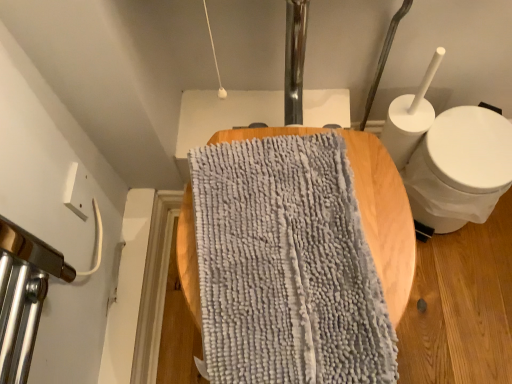
Question: Can you confirm if gray fuzzy bath towel at center is positioned to the left of white matte toilet at right?

Choices:
 (A) yes
 (B) no

Answer: (A)

Question: From the image's perspective, is gray fuzzy bath towel at center below white matte toilet at right?

Choices:
 (A) no
 (B) yes

Answer: (B)

Question: Is gray fuzzy bath towel at center outside white matte toilet at right?

Choices:
 (A) yes
 (B) no

Answer: (A)

Question: Is gray fuzzy bath towel at center facing towards white matte toilet at right?

Choices:
 (A) yes
 (B) no

Answer: (B)

Question: From the image's perspective, would you say gray fuzzy bath towel at center is positioned over white matte toilet at right?

Choices:
 (A) no
 (B) yes

Answer: (A)

Question: Does gray fuzzy bath towel at center have a greater height compared to white matte toilet at right?

Choices:
 (A) no
 (B) yes

Answer: (A)

Question: Is white matte toilet at right turned away from gray fuzzy bath towel at center?

Choices:
 (A) no
 (B) yes

Answer: (A)

Question: Is white matte toilet at right further to camera compared to gray fuzzy bath towel at center?

Choices:
 (A) no
 (B) yes

Answer: (B)

Question: Does white matte toilet at right have a lesser height compared to gray fuzzy bath towel at center?

Choices:
 (A) yes
 (B) no

Answer: (B)

Question: Considering the relative sizes of white matte toilet at right and gray fuzzy bath towel at center in the image provided, is white matte toilet at right thinner than gray fuzzy bath towel at center?

Choices:
 (A) no
 (B) yes

Answer: (B)

Question: From the image's perspective, is white matte toilet at right on top of gray fuzzy bath towel at center?

Choices:
 (A) no
 (B) yes

Answer: (B)

Question: Can you confirm if white matte toilet at right is smaller than gray fuzzy bath towel at center?

Choices:
 (A) no
 (B) yes

Answer: (A)

Question: Do you think white matte toilet at right is within gray fuzzy bath towel at center, or outside of it?

Choices:
 (A) inside
 (B) outside

Answer: (B)